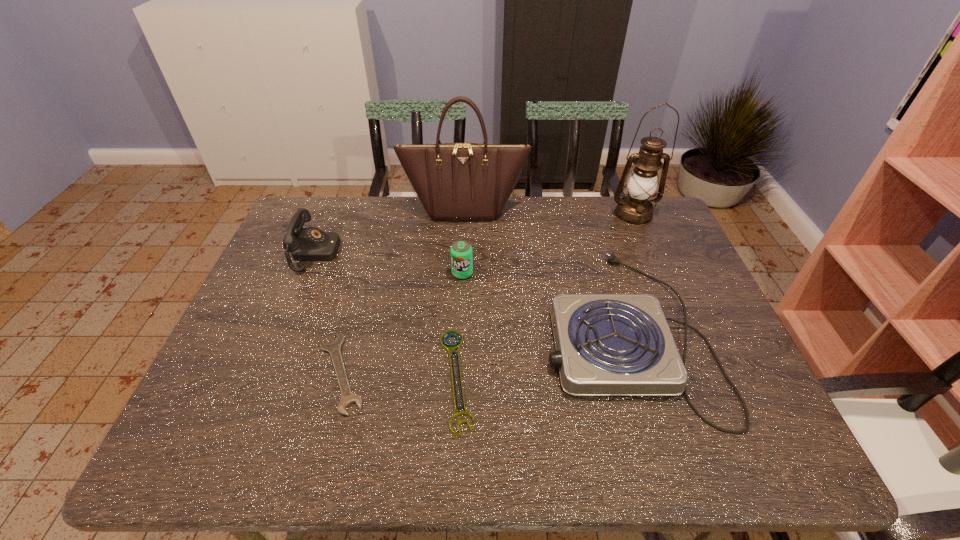
I want to click on blank region between the oil lamp and the left wrench, so click(487, 293).

I want to click on vacant area between the leftmost object and the oil lamp, so click(x=474, y=234).

The image size is (960, 540). I want to click on vacant region between the left wrench and the pop soda, so click(401, 323).

Where is `object that stands as the fifth closest to the fifth tallest object`? The width and height of the screenshot is (960, 540). object that stands as the fifth closest to the fifth tallest object is located at coordinates (334, 348).

What are the coordinates of `object that can be found as the sixth closest to the pop soda` in the screenshot? It's located at (635, 209).

Find the location of a particular element. vacant point that satisfies the following two spatial constraints: 1. on the dial of the right wrench; 2. on the left side of the leftmost object is located at coordinates (264, 380).

The image size is (960, 540). In order to click on vacant space that satisfies the following two spatial constraints: 1. on the front-facing side of the handbag; 2. on the right side of the oil lamp in this screenshot , I will do `click(465, 214)`.

Locate an element on the screen. The width and height of the screenshot is (960, 540). vacant space that satisfies the following two spatial constraints: 1. on the front-facing side of the oil lamp; 2. on the left side of the handbag is located at coordinates pyautogui.click(x=465, y=214).